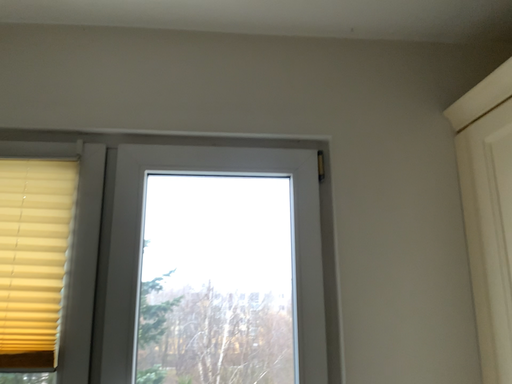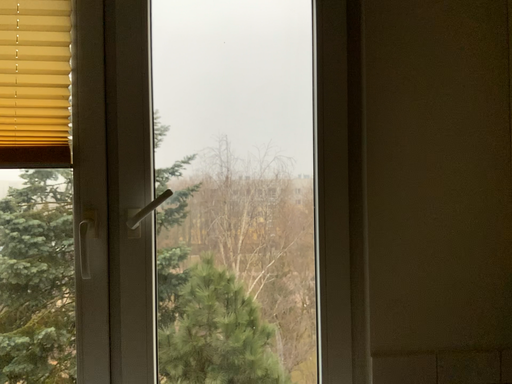
Question: How did the camera likely rotate when shooting the video?

Choices:
 (A) rotated downward
 (B) rotated upward

Answer: (A)